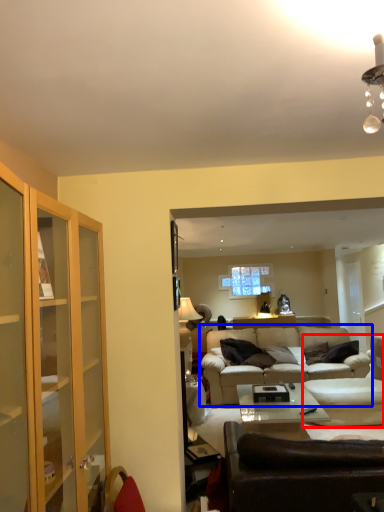
Question: Which of the following is the closest to the observer, swivel chair (highlighted by a red box) or studio couch (highlighted by a blue box)?

Choices:
 (A) swivel chair
 (B) studio couch

Answer: (A)